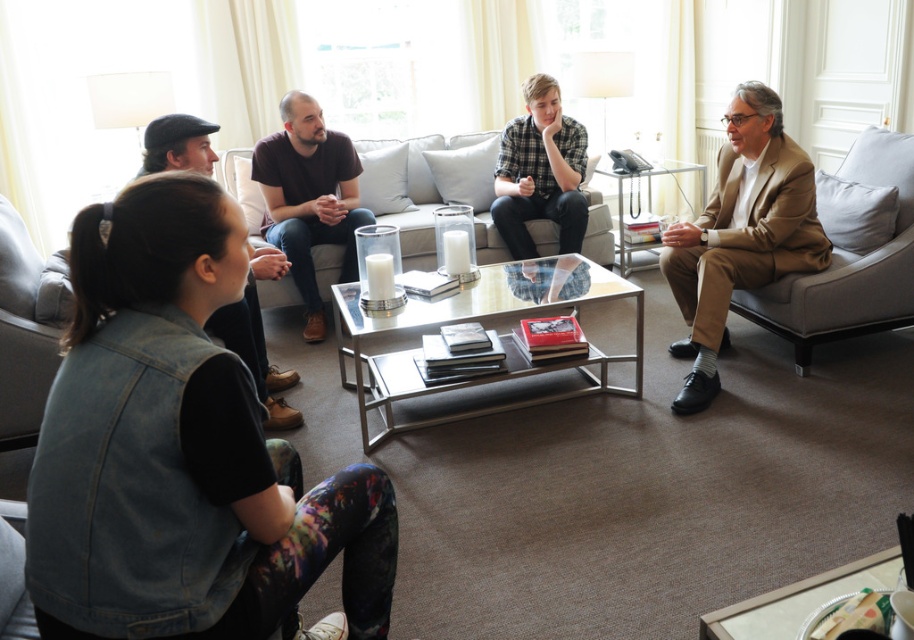
Between point (732, 227) and point (306, 154), which one is positioned behind?

The point (306, 154) is more distant.

Does light brown suit at right appear under dark brown t-shirt at center?

Indeed, light brown suit at right is positioned under dark brown t-shirt at center.

Does point (682, 285) come behind point (314, 140)?

No, (682, 285) is in front of (314, 140).

Where is `light brown suit at right`? The width and height of the screenshot is (914, 640). light brown suit at right is located at coordinates (740, 234).

Does light gray fabric couch at center have a smaller size compared to denim vest at lower left?

Actually, light gray fabric couch at center might be larger than denim vest at lower left.

Can you confirm if light gray fabric couch at center is positioned above denim vest at lower left?

Correct, light gray fabric couch at center is located above denim vest at lower left.

Is point (484, 163) farther from camera compared to point (186, 134)?

Yes, point (484, 163) is farther from viewer.

The image size is (914, 640). Identify the location of light gray fabric couch at center. (417, 205).

Is point (688, 301) closer to camera compared to point (511, 131)?

Yes, it is in front of point (511, 131).

Who is shorter, light brown suit at right or plaid shirt at center?

Standing shorter between the two is plaid shirt at center.

Does point (740, 184) come farther from viewer compared to point (506, 211)?

No, it is in front of (506, 211).

Locate an element on the screen. light brown suit at right is located at coordinates (740, 234).